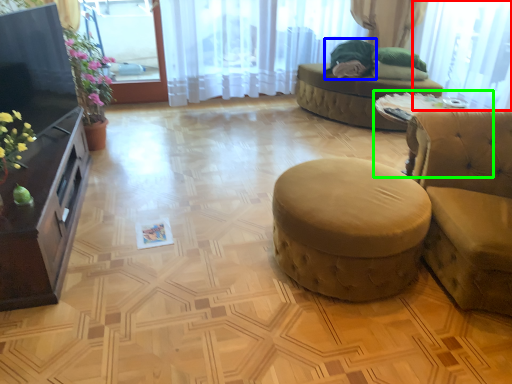
Question: Considering the real-world distances, which object is farthest from window screen (highlighted by a red box)? open (highlighted by a blue box) or round table (highlighted by a green box)?

Choices:
 (A) open
 (B) round table

Answer: (A)